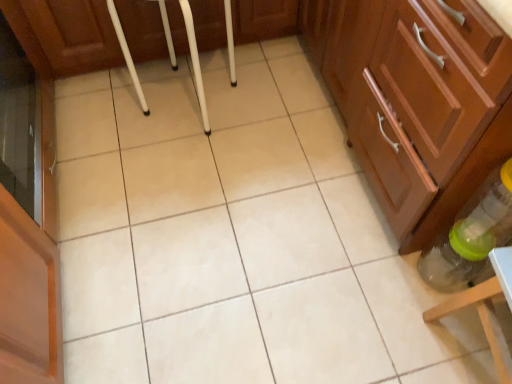
Question: Considering the relative sizes of matte wood cabinet at center-right, which ranks as the second cabinetry in top-to-bottom order, and translucent plastic bottle at lower right in the image provided, is matte wood cabinet at center-right, which ranks as the second cabinetry in top-to-bottom order, shorter than translucent plastic bottle at lower right?

Choices:
 (A) yes
 (B) no

Answer: (A)

Question: Is matte wood cabinet at center-right, which ranks as the second cabinetry in top-to-bottom order, surrounding translucent plastic bottle at lower right?

Choices:
 (A) no
 (B) yes

Answer: (A)

Question: Can you confirm if matte wood cabinet at center-right, the 1th cabinetry positioned from the bottom, is wider than translucent plastic bottle at lower right?

Choices:
 (A) no
 (B) yes

Answer: (B)

Question: Are matte wood cabinet at center-right, which ranks as the second cabinetry in top-to-bottom order, and translucent plastic bottle at lower right far apart?

Choices:
 (A) no
 (B) yes

Answer: (A)

Question: From the image's perspective, is matte wood cabinet at center-right, which ranks as the second cabinetry in top-to-bottom order, located beneath translucent plastic bottle at lower right?

Choices:
 (A) yes
 (B) no

Answer: (B)

Question: Is point (90, 46) closer or farther from the camera than point (443, 291)?

Choices:
 (A) closer
 (B) farther

Answer: (B)

Question: From a real-world perspective, relative to translucent plastic bottle at lower right, is wooden cabinet at center, arranged as the first cabinetry when viewed from the top, vertically above or below?

Choices:
 (A) below
 (B) above

Answer: (A)

Question: Considering the positions of wooden cabinet at center, arranged as the first cabinetry when viewed from the top, and translucent plastic bottle at lower right in the image, is wooden cabinet at center, arranged as the first cabinetry when viewed from the top, wider or thinner than translucent plastic bottle at lower right?

Choices:
 (A) wide
 (B) thin

Answer: (A)

Question: Which is correct: wooden cabinet at center, arranged as the first cabinetry when viewed from the top, is inside translucent plastic bottle at lower right, or outside of it?

Choices:
 (A) inside
 (B) outside

Answer: (B)

Question: In the image, is translucent plastic bottle at lower right positioned in front of or behind matte wood cabinet at center-right, the 1th cabinetry positioned from the bottom?

Choices:
 (A) front
 (B) behind

Answer: (A)

Question: From the image's perspective, is translucent plastic bottle at lower right located above or below matte wood cabinet at center-right, which ranks as the second cabinetry in top-to-bottom order?

Choices:
 (A) above
 (B) below

Answer: (B)

Question: Based on their sizes in the image, would you say translucent plastic bottle at lower right is bigger or smaller than matte wood cabinet at center-right, the 1th cabinetry positioned from the bottom?

Choices:
 (A) small
 (B) big

Answer: (A)

Question: In the image, is translucent plastic bottle at lower right on the left side or the right side of matte wood cabinet at center-right, the 1th cabinetry positioned from the bottom?

Choices:
 (A) right
 (B) left

Answer: (A)

Question: From the image's perspective, is matte wood cabinet at center-right, which ranks as the second cabinetry in top-to-bottom order, located above or below translucent plastic bottle at lower right?

Choices:
 (A) below
 (B) above

Answer: (B)

Question: From a real-world perspective, is matte wood cabinet at center-right, which ranks as the second cabinetry in top-to-bottom order, physically located above or below translucent plastic bottle at lower right?

Choices:
 (A) below
 (B) above

Answer: (A)